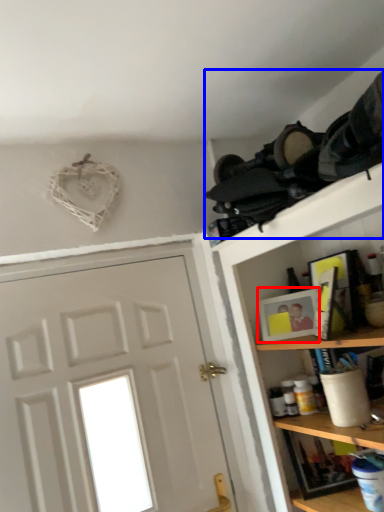
Question: Which point is closer to the camera, picture frame (highlighted by a red box) or laundry (highlighted by a blue box)?

Choices:
 (A) picture frame
 (B) laundry

Answer: (B)